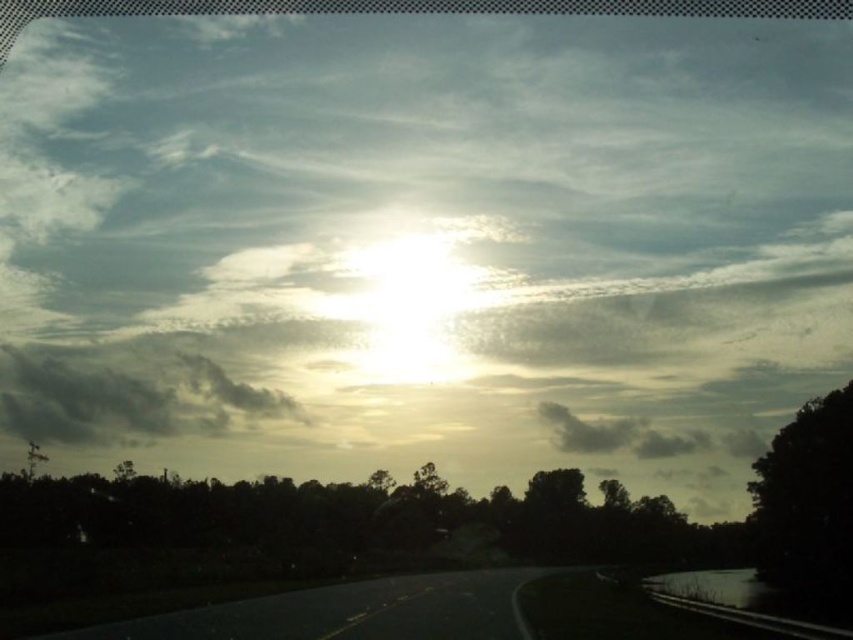
You are standing at the point marked as point (236, 488) on the road. You want to walk to the sun. Which direction should you face?

The sun is positioned low on the horizon. Since the point is 173.67 meters away from you, you should face the direction where the sun is located, which is either east during sunrise or west during sunset. However, without knowing the exact time, you can look towards the horizon where the sky is illuminated with the soft glow to determine the sun direction.

From the picture: You are standing at the starting point of the road and want to walk towards the silhouette leafy tree at lower center. Which direction should you walk to reach it?

The silhouette leafy tree at lower center is located at the lower center of the image, so you should walk towards the center of the road to reach it.